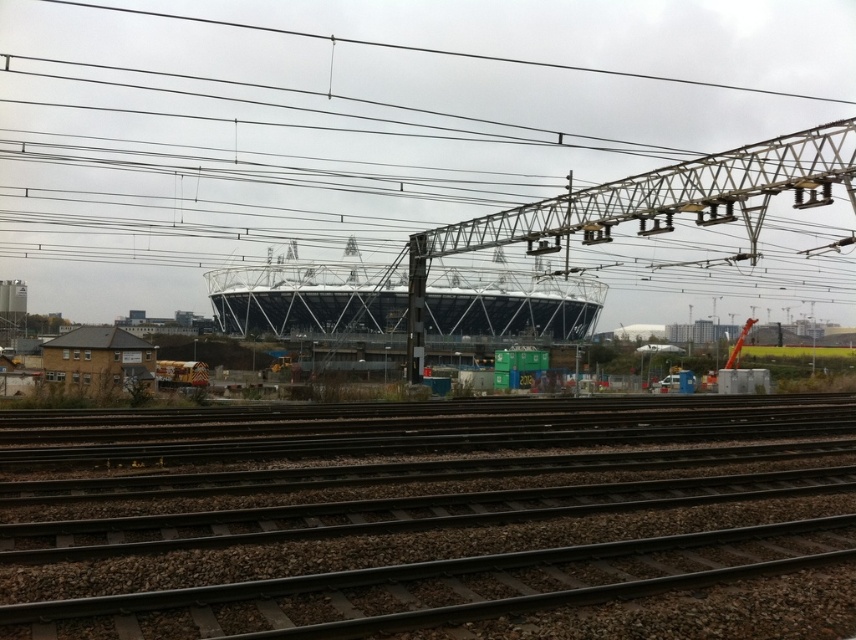
From the picture: You are a railway engineer inspecting the tracks. You notice a point labeled at coordinates (360, 120). Based on the scene description, what object is located at that point?

The point at coordinates (360, 120) marks the location of a metallic wire at center.